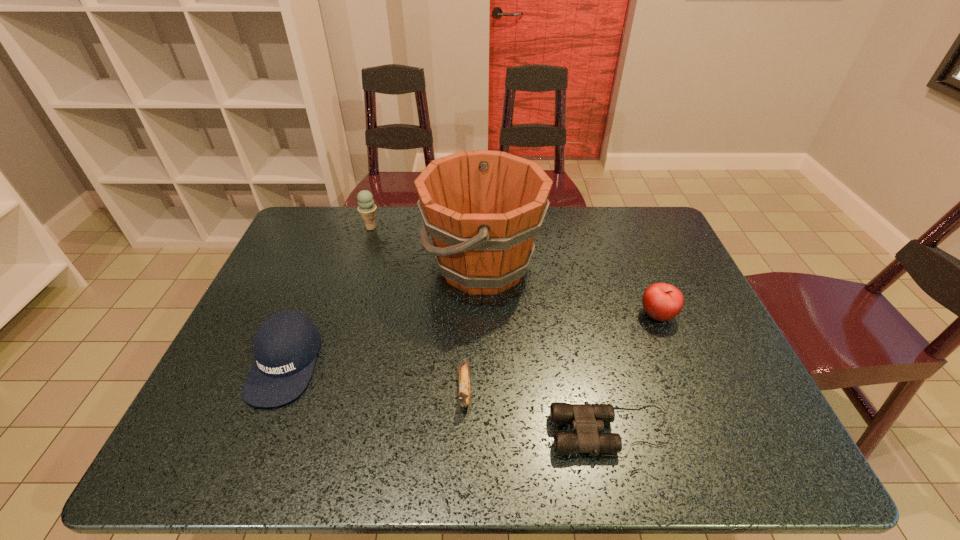
The height and width of the screenshot is (540, 960). I want to click on object located in the right edge section of the desktop, so click(661, 301).

Locate an element on the screen. Image resolution: width=960 pixels, height=540 pixels. free region at the far edge of the desktop is located at coordinates (362, 227).

Identify the location of free space at the near edge of the desktop. (461, 436).

In the image, there is a desktop. Identify the location of vacant space at the left edge. Image resolution: width=960 pixels, height=540 pixels. (270, 275).

Locate an element on the screen. The height and width of the screenshot is (540, 960). blank area at the right edge is located at coordinates tap(693, 340).

This screenshot has width=960, height=540. In the image, there is a desktop. In order to click on free space at the far left corner in this screenshot , I will do `click(337, 219)`.

Identify the location of free location at the far right corner of the desktop. The image size is (960, 540). (634, 215).

The width and height of the screenshot is (960, 540). I want to click on blank region between the baseball cap and the apple, so click(x=471, y=339).

The image size is (960, 540). Find the location of `unoccupied area between the bucket and the second shortest object`. unoccupied area between the bucket and the second shortest object is located at coordinates (474, 329).

The height and width of the screenshot is (540, 960). I want to click on free space between the banana and the ice cream, so click(418, 309).